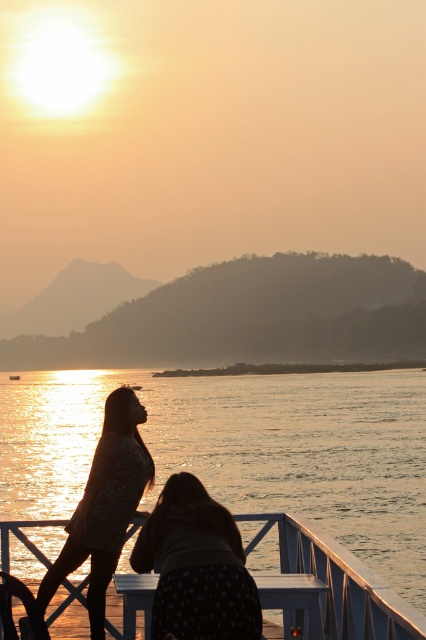
Question: Estimate the real-world distances between objects in this image. Which object is closer to the white painted wood deck at lower center?

Choices:
 (A) polka dot fabric woman at lower center
 (B) glistening water at lower center
 (C) silhouette floral dress at center

Answer: (A)

Question: Is white painted wood deck at lower center smaller than silhouette floral dress at center?

Choices:
 (A) yes
 (B) no

Answer: (A)

Question: Does polka dot fabric woman at lower center appear on the left side of white painted wood deck at lower center?

Choices:
 (A) no
 (B) yes

Answer: (B)

Question: Is glistening water at lower center thinner than white painted wood deck at lower center?

Choices:
 (A) no
 (B) yes

Answer: (A)

Question: Which point appears farthest from the camera in this image?

Choices:
 (A) (115, 476)
 (B) (161, 604)

Answer: (A)

Question: Which object appears farthest from the camera in this image?

Choices:
 (A) polka dot fabric woman at lower center
 (B) glistening water at lower center
 (C) silhouette floral dress at center

Answer: (C)